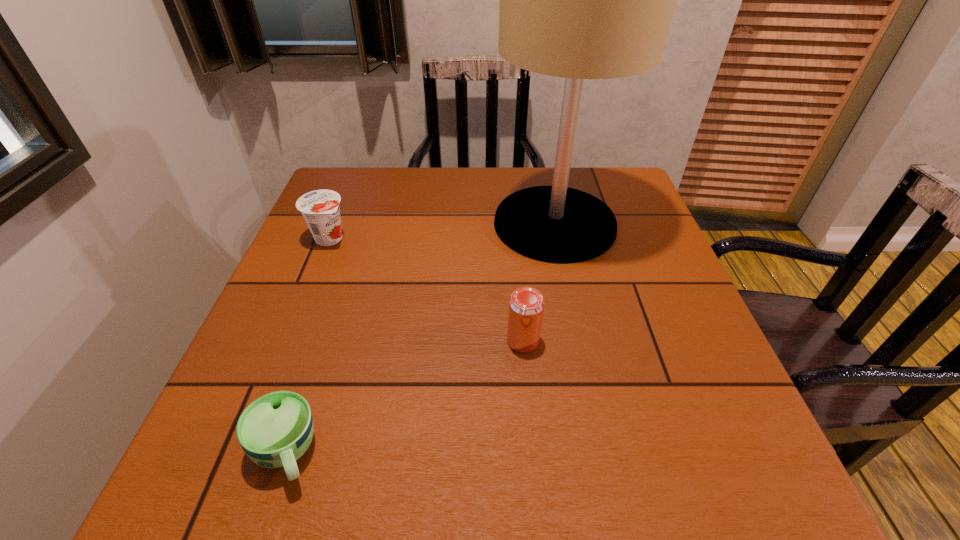
Image resolution: width=960 pixels, height=540 pixels. I want to click on free spot at the far left corner of the desktop, so click(342, 171).

Locate an element on the screen. The width and height of the screenshot is (960, 540). free space at the near left corner of the desktop is located at coordinates (247, 491).

Locate an element on the screen. blank area at the near right corner is located at coordinates (700, 453).

Locate an element on the screen. free spot between the table lamp and the beer can is located at coordinates (539, 282).

Identify the location of vacant area that lies between the beer can and the shortest object. The width and height of the screenshot is (960, 540). (404, 396).

This screenshot has height=540, width=960. I want to click on free space between the table lamp and the yogurt, so click(442, 231).

Find the location of a particular element. This screenshot has height=540, width=960. unoccupied position between the yogurt and the tallest object is located at coordinates (442, 231).

Where is `unoccupied area between the shortest object and the tallest object`? This screenshot has width=960, height=540. unoccupied area between the shortest object and the tallest object is located at coordinates (420, 338).

Locate an element on the screen. The height and width of the screenshot is (540, 960). free area in between the third farthest object and the table lamp is located at coordinates (539, 282).

Identify the location of empty space between the cup and the yogurt. The image size is (960, 540). (307, 345).